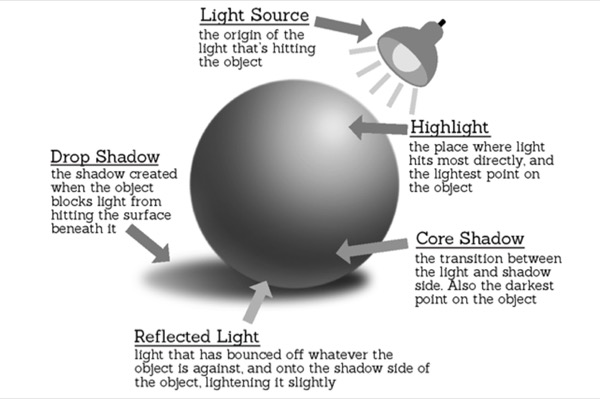
Locate an element on the screen. light bulb is located at coordinates (410, 60).